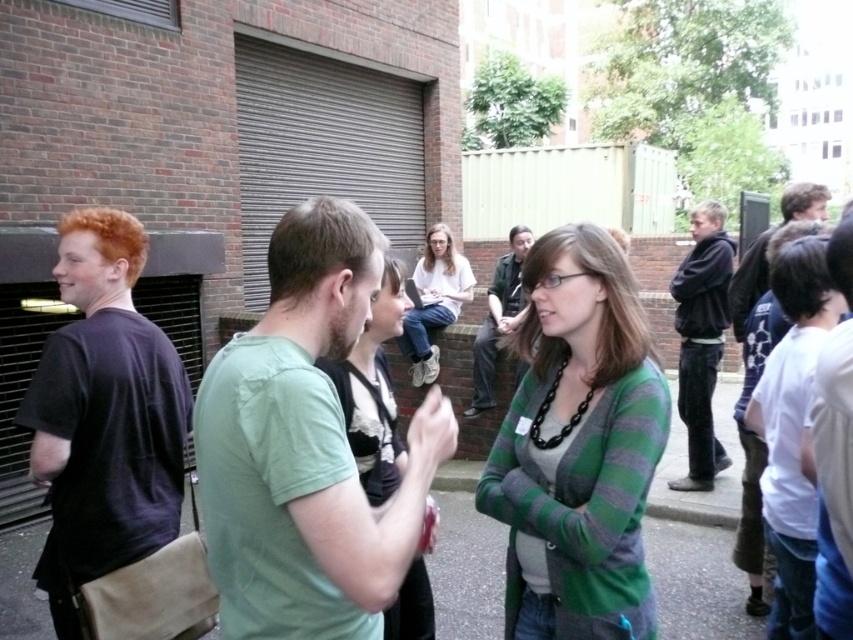
You are a photographer trying to capture a group photo of the green cotton shirt at center and the white shirt at center. Since you want to ensure both are fully visible, which person should you position closer to the camera?

The green cotton shirt at center should be positioned closer to the camera because it is already in front of the white shirt at center, ensuring both are visible without overlapping.

You are organizing a clothing donation drive and need to determine which clothing items can fit into a standard donation box. The donation box can only accommodate items with a width of 30 cm or less. You observe a matte green cardigan at center and a white cotton shirt at right. Based on their widths, which item is more likely to fit into the donation box?

The white cotton shirt at right is more likely to fit into the donation box since its width is smaller than the matte green cardigan at center, and the donation box can only accommodate items up to 30 cm in width.

You are standing at point (502, 282) and want to walk to point (553, 509). Is the point you want to reach in front of you or behind you?

A: Point (553, 509) is in front of point (502, 282), so the point you want to reach is in front of you.